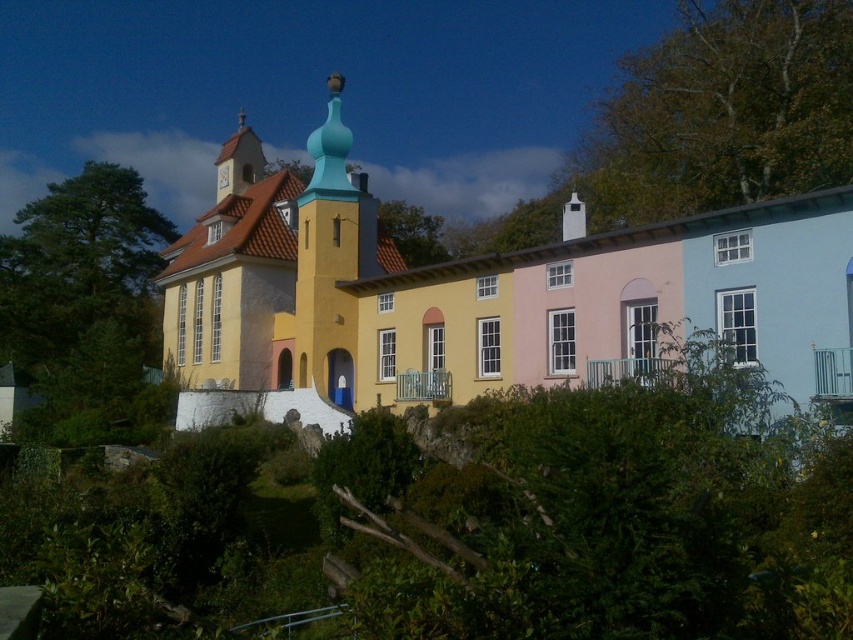
You are standing in front of the building and want to take a photo that includes both the green leafy tree at left and the green leafy tree at center. Which tree will appear larger in the photo?

The green leafy tree at left will appear larger in the photo because it is much taller than the green leafy tree at center.

From the picture: You are a photographer trying to capture the entire yellow matte building at center and the green leafy tree at upper right in one frame. Based on their sizes, which one should you focus on to ensure both fit in the photo?

The yellow matte building at center is bigger than the green leafy tree at upper right, so you should focus on the yellow matte building at center to ensure both fit in the photo.

You are standing at the base of the building and want to locate the point at coordinates (724, 112). Based on the scene description, where would this point be located relative to the building and its surroundings?

The point at coordinates (724, 112) is on the green leafy tree at the upper right of the scene.